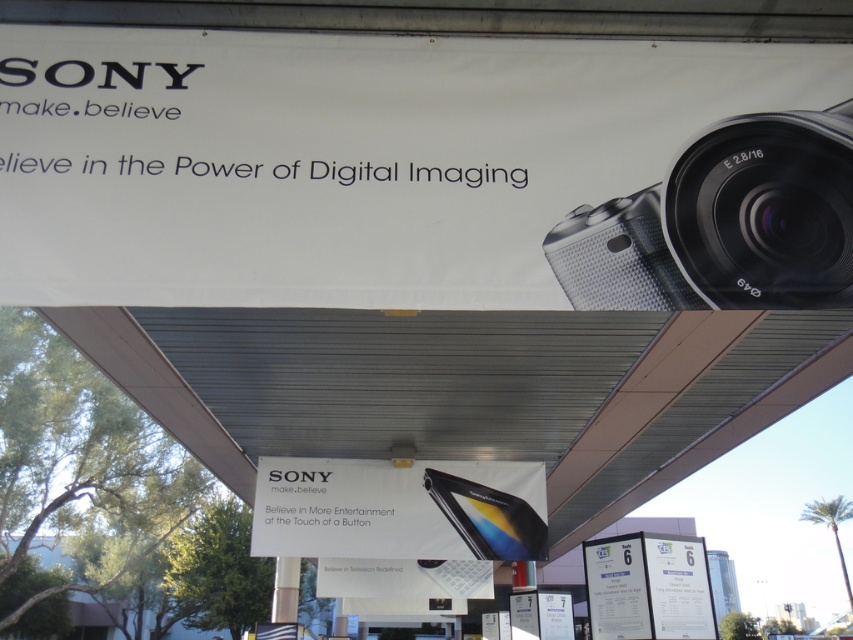
You are designing a poster and need to place both the silver textured camera at upper right and the black glossy smartphone at center. Since the poster has limited space, which object should you prioritize placing first to ensure it fits?

The silver textured camera at upper right should be prioritized because it occupies less space than the black glossy smartphone at center, making it easier to fit first.

You are standing in front of the Sony promotional setup and want to take a photo. There are two points of interest marked as point 1 at coordinates point (773, 221) and point 2 at coordinates point (418, 497). Which point should you focus on first to ensure it appears sharp in your photo?

Point (773, 221) is closer to the camera than point (418, 497), so you should focus on point (773, 221) first to ensure it appears sharp in your photo.

You are a Sony employee setting up a promotional booth. You need to place a 3.5 feet wide Sony camera case between the black glossy smartphone at center and the white paper at lower right. Will there be enough space to fit the case between them?

The black glossy smartphone at center and white paper at lower right are 5.39 feet apart. Since the camera case is 3.5 feet wide, there is enough space to place it between them as 5.39 feet is greater than 3.5 feet.